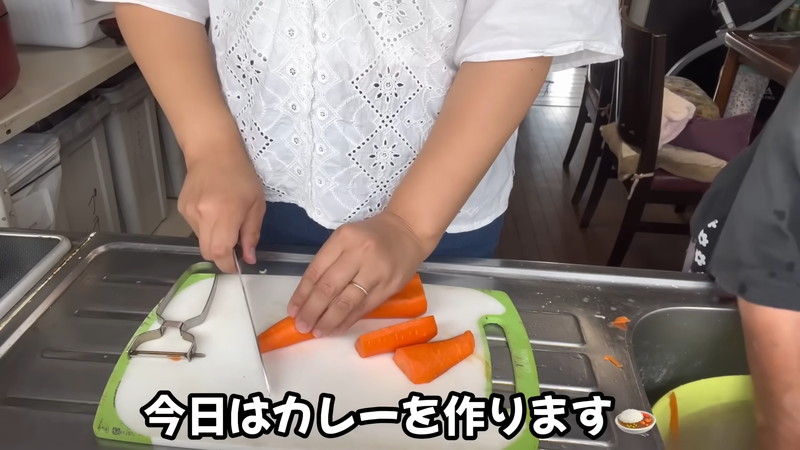
The height and width of the screenshot is (450, 800). Identify the location of basin top. (554, 345).